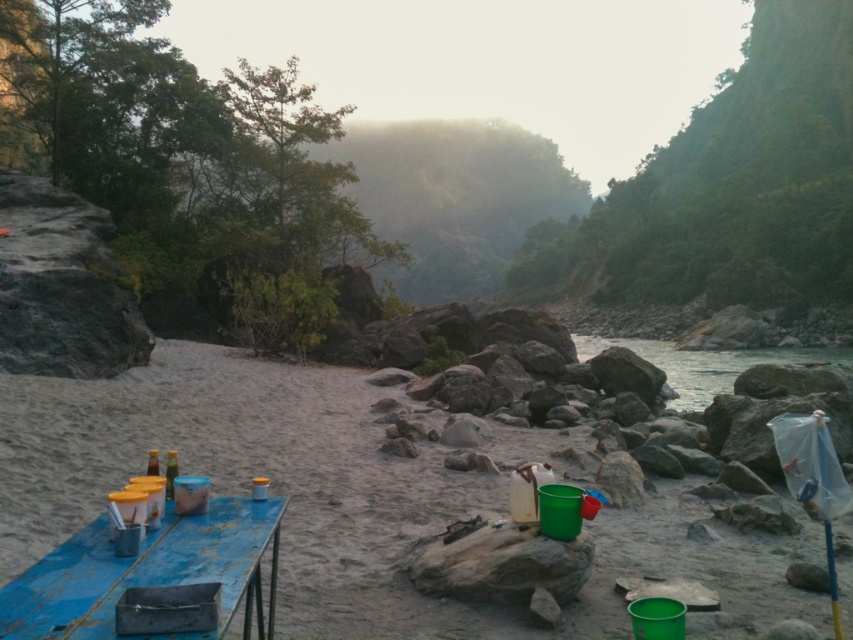
From the picture: You are standing at the riverside and want to place a heavy backpack on the ground. Which location would be more stable for placing it, the sandy beach at center or the clear water at river right?

The sandy beach at center is closer to the viewer than clear water at river right, so placing the backpack on the sandy beach at center would be more stable as it is solid ground.